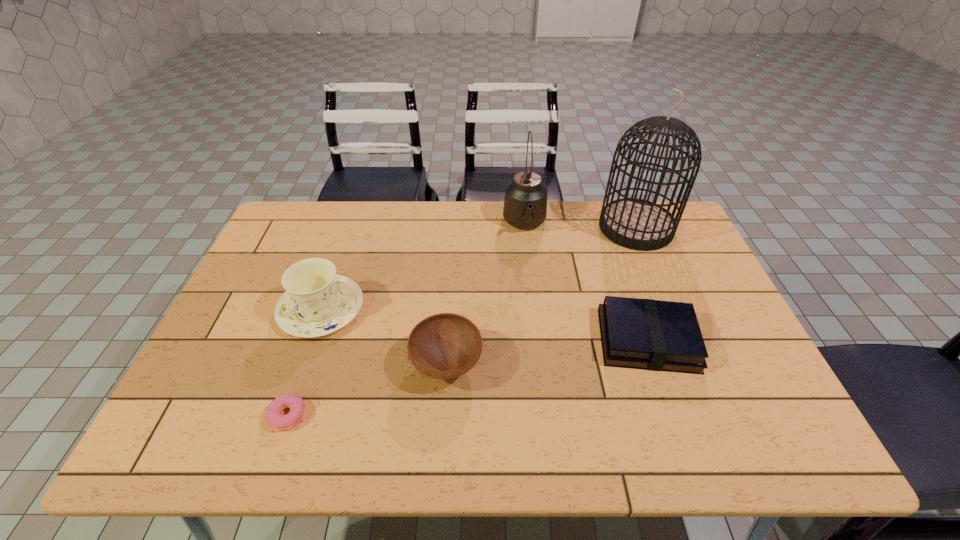
Locate an element on the screen. The height and width of the screenshot is (540, 960). vacant space that satisfies the following two spatial constraints: 1. on the back side of the third shortest object; 2. on the handle side of the chinaware is located at coordinates click(x=450, y=309).

Locate an element on the screen. The height and width of the screenshot is (540, 960). free space that satisfies the following two spatial constraints: 1. on the handle side of the third tallest object; 2. on the right side of the shortest object is located at coordinates (285, 416).

What are the coordinates of `vacant space that satisfies the following two spatial constraints: 1. spout on the kettle; 2. on the right side of the second shortest object` in the screenshot? It's located at (539, 340).

Where is `vacant area in the image that satisfies the following two spatial constraints: 1. on the back side of the third object from left to right; 2. on the left side of the doughnut`? This screenshot has width=960, height=540. vacant area in the image that satisfies the following two spatial constraints: 1. on the back side of the third object from left to right; 2. on the left side of the doughnut is located at coordinates (305, 364).

Locate an element on the screen. The width and height of the screenshot is (960, 540). vacant area in the image that satisfies the following two spatial constraints: 1. on the handle side of the chinaware; 2. on the back side of the book is located at coordinates [x=311, y=340].